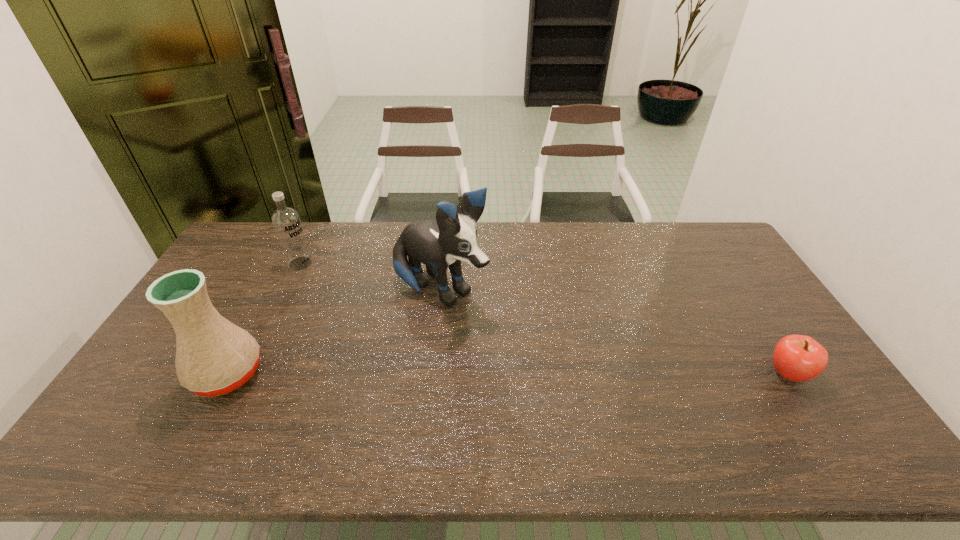
Where is `pottery`? pottery is located at coordinates (214, 356).

You are a GUI agent. You are given a task and a screenshot of the screen. Output one action in this format:
    pyautogui.click(x=<x>, y=<y>)
    Task: Click on the shortest object
    Image resolution: width=960 pixels, height=540 pixels.
    Given the screenshot: What is the action you would take?
    pyautogui.click(x=798, y=358)

The image size is (960, 540). I want to click on apple, so click(x=798, y=358).

Identify the location of puppy. Image resolution: width=960 pixels, height=540 pixels. (453, 239).

You are a GUI agent. You are given a task and a screenshot of the screen. Output one action in this format:
    pyautogui.click(x=<x>, y=<y>)
    Task: Click on the second object from right to left
    Image resolution: width=960 pixels, height=540 pixels.
    Given the screenshot: What is the action you would take?
    pyautogui.click(x=453, y=239)

Where is `vodka`? The width and height of the screenshot is (960, 540). vodka is located at coordinates coord(286,221).

The image size is (960, 540). What are the coordinates of `vacant space situated 0.160m on the back of the pottery` in the screenshot? It's located at (263, 306).

The width and height of the screenshot is (960, 540). I want to click on vacant region located 0.080m on the front of the shortest object, so click(x=817, y=419).

This screenshot has height=540, width=960. Identify the location of vacant space located on the front-facing side of the tallest object. (560, 368).

Find the location of a particular element. The width and height of the screenshot is (960, 540). free point located 0.200m on the front-facing side of the tallest object is located at coordinates (525, 345).